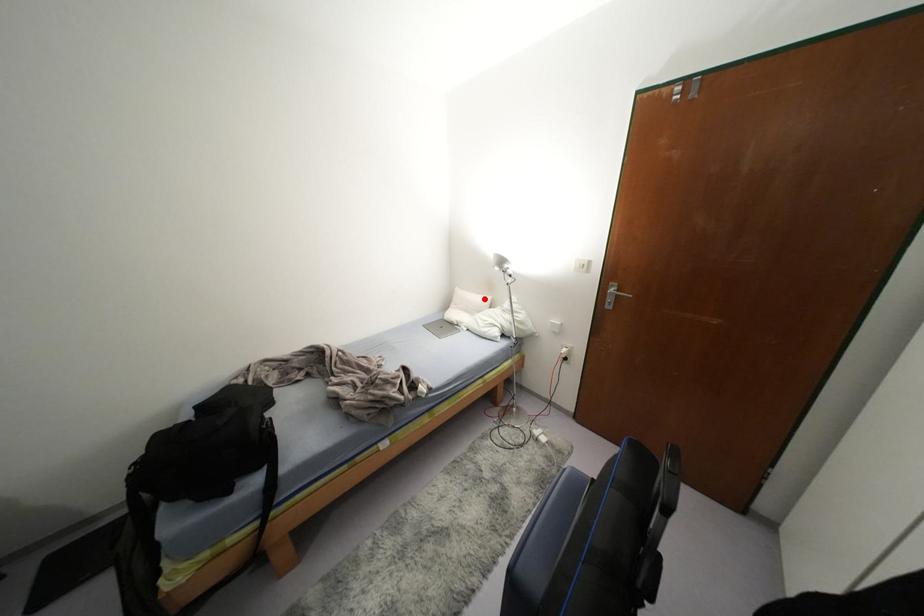
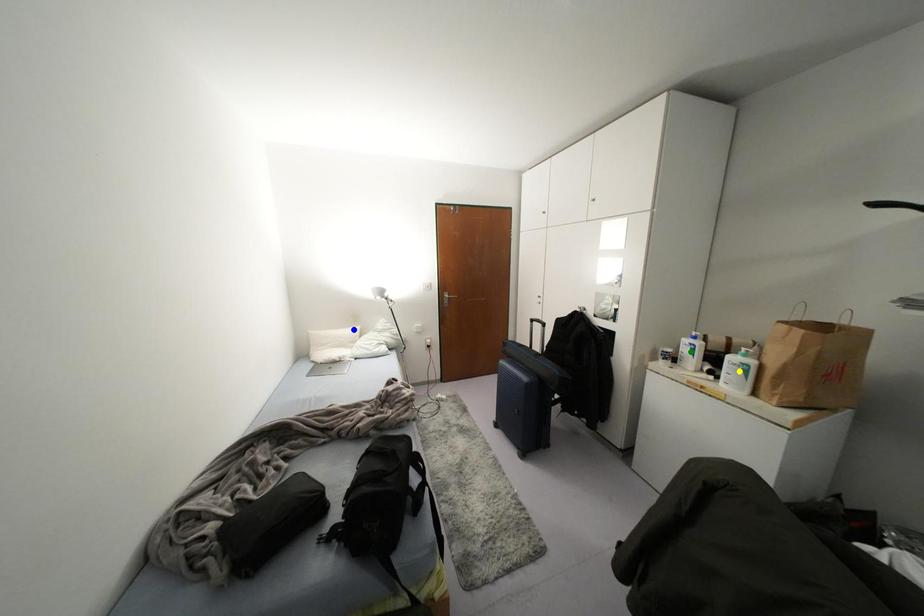
Question: I am providing you with two images of the same scene from different viewpoints. A red point is marked on the first image. You are given multiple points on the second image. Which spot in image 2 lines up with the point in image 1?

Choices:
 (A) yellow point
 (B) blue point
 (C) green point

Answer: (B)